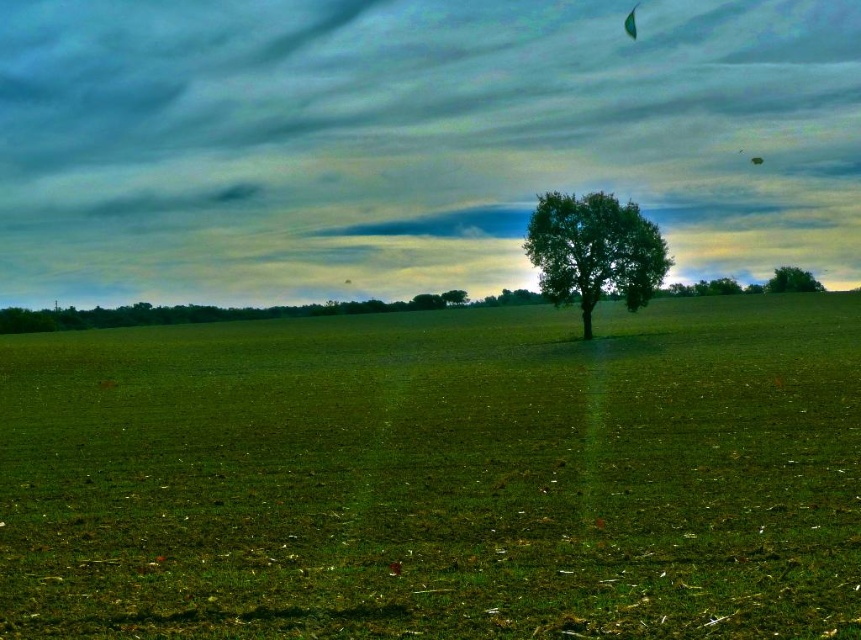
Between green grassy field at center and green leafy tree at upper right, which one appears on the left side from the viewer's perspective?

green grassy field at center

Between point (646, 412) and point (775, 278), which one is positioned behind?

The point (775, 278) is more distant.

Locate an element on the screen. This screenshot has height=640, width=861. green grassy field at center is located at coordinates (438, 476).

Between green leafy tree at center and green leafy tree at upper right, which one is positioned lower?

green leafy tree at center

Is point (573, 240) farther from camera compared to point (777, 268)?

No, it is in front of (777, 268).

You are a GUI agent. You are given a task and a screenshot of the screen. Output one action in this format:
    pyautogui.click(x=<x>, y=<y>)
    Task: Click on the green leafy tree at center
    This screenshot has height=640, width=861.
    Given the screenshot: What is the action you would take?
    pyautogui.click(x=593, y=250)

Is green grassy field at center in front of green fabric parachute at upper center?

That is True.

Who is more distant from viewer, (237, 588) or (624, 20)?

The point (624, 20) is more distant.

The width and height of the screenshot is (861, 640). What do you see at coordinates (438, 476) in the screenshot?
I see `green grassy field at center` at bounding box center [438, 476].

Where is `green grassy field at center`? green grassy field at center is located at coordinates (438, 476).